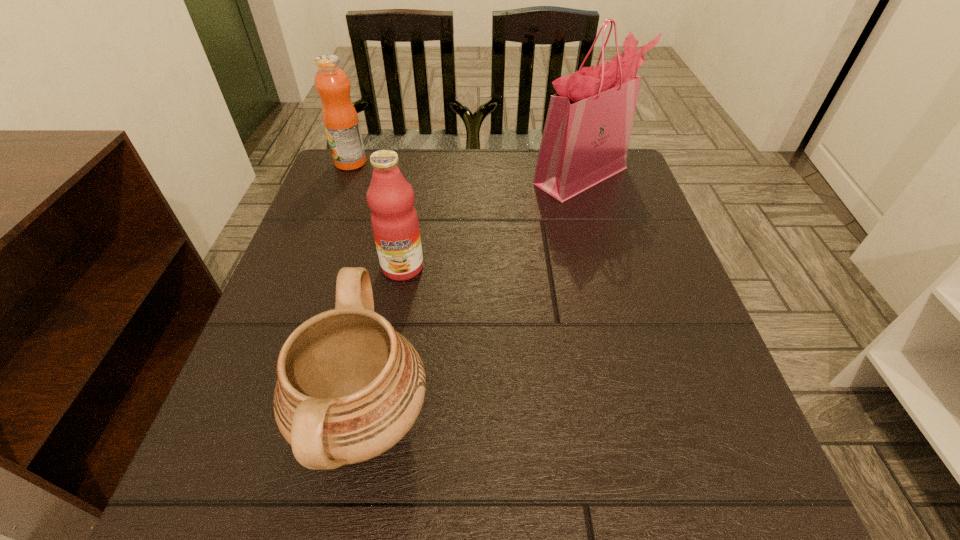
I want to click on the tallest object, so click(x=586, y=136).

I want to click on shopping bag, so click(x=586, y=136).

Locate an element on the screen. The image size is (960, 540). the farther fruit juice is located at coordinates (332, 84).

The image size is (960, 540). I want to click on the leftmost object, so click(x=332, y=84).

Locate an element on the screen. The height and width of the screenshot is (540, 960). the nearer fruit juice is located at coordinates (394, 220).

The image size is (960, 540). Identify the location of the third farthest object. (394, 220).

Identify the location of the nearest object. (349, 387).

Where is `the shortest object`? The width and height of the screenshot is (960, 540). the shortest object is located at coordinates (349, 387).

At what (x,y) coordinates should I click in order to perform the action: click on vacant space situated 0.320m on the left of the tallest object. Please return your answer as a coordinate pair (x, y). Looking at the image, I should click on (409, 176).

The width and height of the screenshot is (960, 540). I want to click on free space located 0.290m on the right of the leftmost object, so click(474, 163).